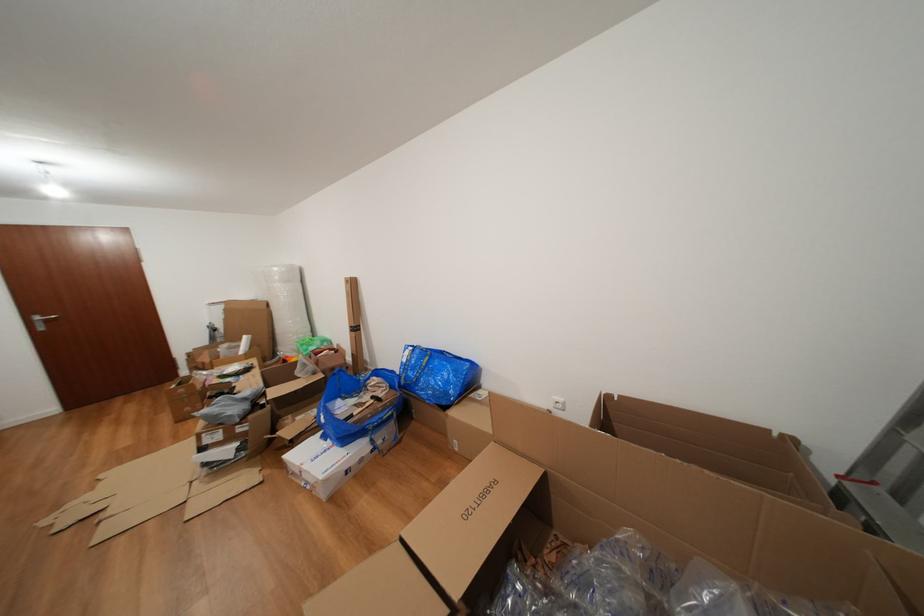
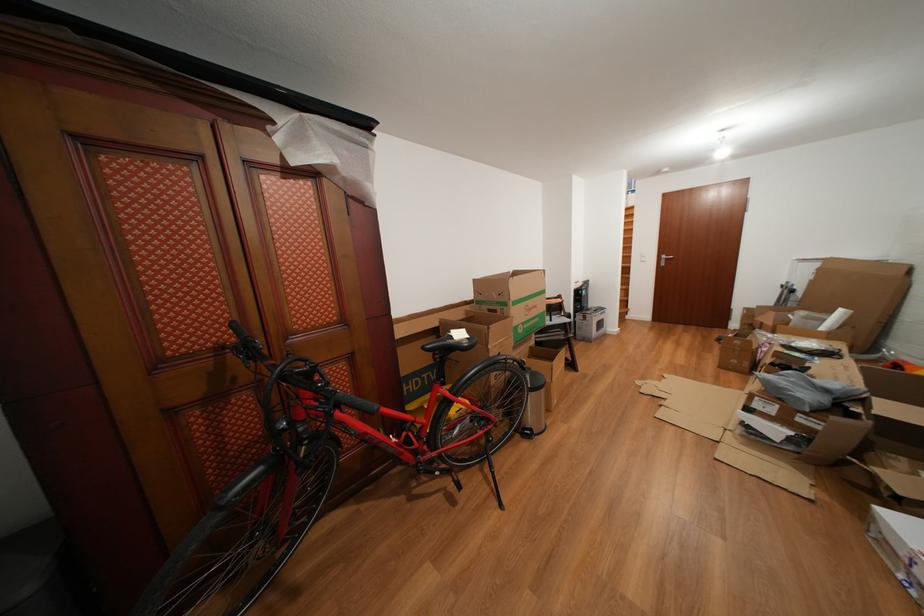
The first image is from the beginning of the video and the second image is from the end. How did the camera likely rotate when shooting the video?

The rotation direction of the camera is left-down.